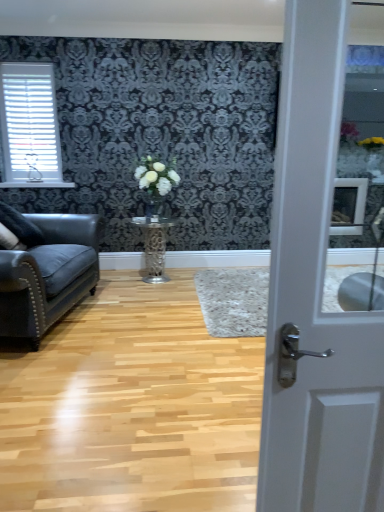
Question: Considering the relative sizes of white glossy vase at center and wooden floor at center in the image provided, is white glossy vase at center smaller than wooden floor at center?

Choices:
 (A) yes
 (B) no

Answer: (A)

Question: Is white glossy vase at center bigger than wooden floor at center?

Choices:
 (A) no
 (B) yes

Answer: (A)

Question: Is white glossy vase at center looking in the opposite direction of wooden floor at center?

Choices:
 (A) no
 (B) yes

Answer: (A)

Question: Considering the relative sizes of white glossy vase at center and wooden floor at center in the image provided, is white glossy vase at center shorter than wooden floor at center?

Choices:
 (A) yes
 (B) no

Answer: (B)

Question: Does white glossy vase at center come behind wooden floor at center?

Choices:
 (A) no
 (B) yes

Answer: (B)

Question: Choose the correct answer: Is white glossy vase at center inside leather couch at left or outside it?

Choices:
 (A) outside
 (B) inside

Answer: (A)

Question: From their relative heights in the image, would you say white glossy vase at center is taller or shorter than leather couch at left?

Choices:
 (A) tall
 (B) short

Answer: (B)

Question: Considering the positions of point 158,194 and point 74,275, is point 158,194 closer or farther from the camera than point 74,275?

Choices:
 (A) closer
 (B) farther

Answer: (B)

Question: Considering their positions, is white glossy vase at center located in front of or behind leather couch at left?

Choices:
 (A) behind
 (B) front

Answer: (A)

Question: From the image's perspective, is metallic silver table at center positioned above or below white glossy door at center?

Choices:
 (A) above
 (B) below

Answer: (A)

Question: From a real-world perspective, relative to white glossy door at center, is metallic silver table at center vertically above or below?

Choices:
 (A) above
 (B) below

Answer: (B)

Question: In terms of size, does metallic silver table at center appear bigger or smaller than white glossy door at center?

Choices:
 (A) big
 (B) small

Answer: (A)

Question: Is metallic silver table at center situated inside white glossy door at center or outside?

Choices:
 (A) outside
 (B) inside

Answer: (A)

Question: Is white glossy door at center bigger or smaller than leather couch at left?

Choices:
 (A) small
 (B) big

Answer: (A)

Question: Considering the relative positions of white glossy door at center and leather couch at left in the image provided, is white glossy door at center to the left or to the right of leather couch at left?

Choices:
 (A) right
 (B) left

Answer: (A)